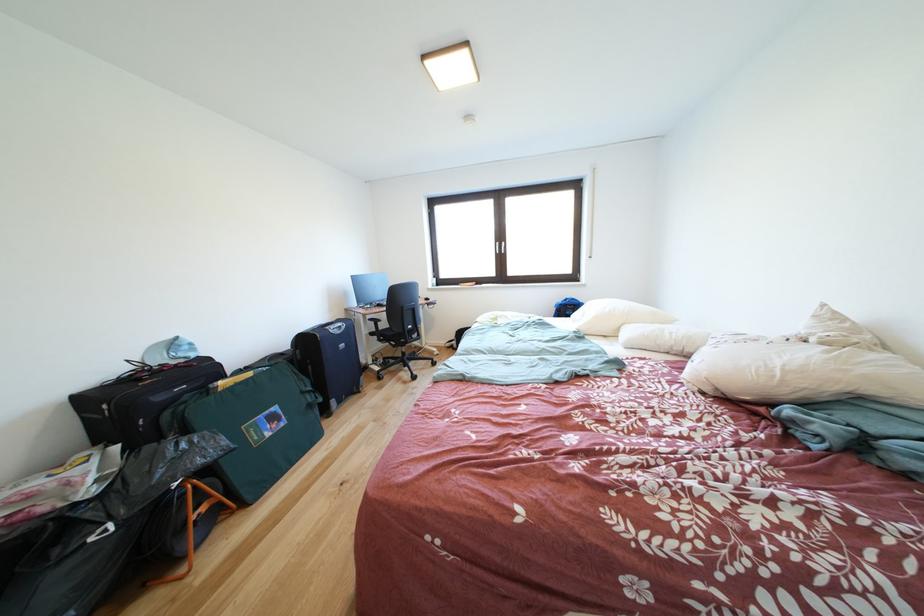
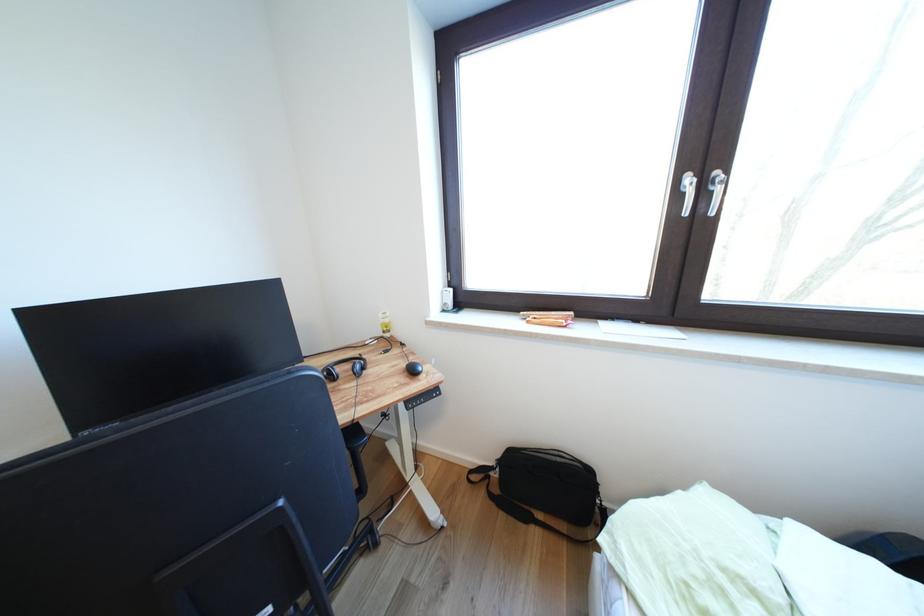
Question: Which direction would the cameraman need to move to produce the second image? Reply with the corresponding letter.

Choices:
 (A) Left
 (B) Right
 (C) Forward
 (D) Backward

Answer: (C)